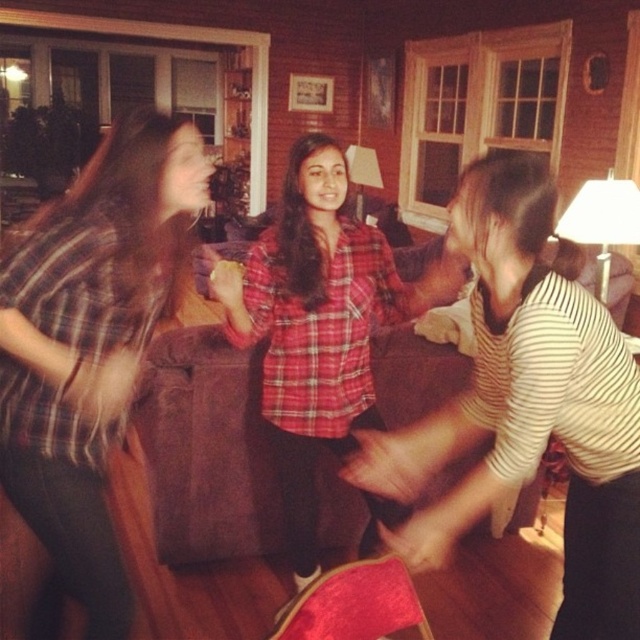
You are a photographer trying to capture a candid shot of the two people at the center of the scene. Since the striped cotton shirt at center and the plaid shirt at center are overlapping, which one is blocking the view of the other?

The striped cotton shirt at center is below the plaid shirt at center, so the plaid shirt at center is blocking the view of the striped cotton shirt at center.